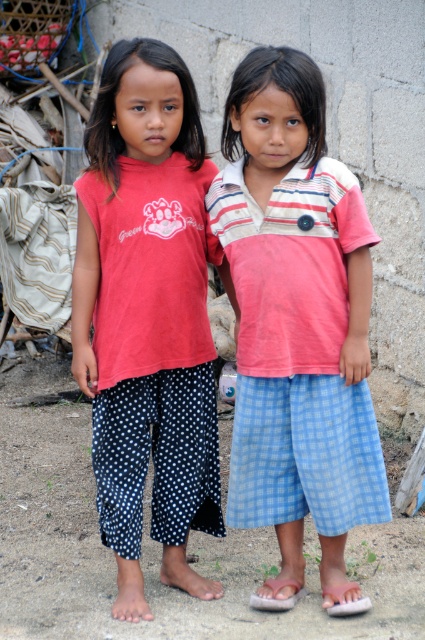
Does matte red shirt at left have a greater height compared to brown leather sandal at lower center?

Indeed, matte red shirt at left has a greater height compared to brown leather sandal at lower center.

Between matte red shirt at left and brown leather sandal at lower center, which one is positioned lower?

brown leather sandal at lower center is below.

Is point (215, 465) positioned behind point (299, 582)?

Yes, point (215, 465) is farther from viewer.

At what (x,y) coordinates should I click in order to perform the action: click on matte red shirt at left. Please return your answer as a coordinate pair (x, y). This screenshot has width=425, height=640. Looking at the image, I should click on (147, 316).

Is matte red shirt at left closer to camera compared to white rubber sandal at lower right?

That is True.

Looking at this image, is matte red shirt at left bigger than white rubber sandal at lower right?

Correct, matte red shirt at left is larger in size than white rubber sandal at lower right.

The width and height of the screenshot is (425, 640). In order to click on matte red shirt at left in this screenshot , I will do `click(147, 316)`.

Can you confirm if striped cotton shirt at center is positioned to the right of white rubber sandal at lower right?

In fact, striped cotton shirt at center is to the left of white rubber sandal at lower right.

Which of these two, striped cotton shirt at center or white rubber sandal at lower right, stands taller?

striped cotton shirt at center is taller.

Find the location of a particular element. The height and width of the screenshot is (640, 425). striped cotton shirt at center is located at coordinates (297, 316).